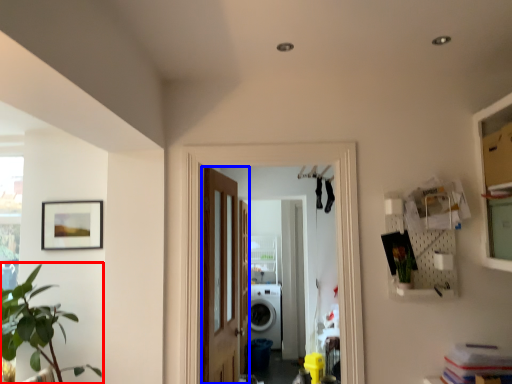
Question: Among these objects, which one is nearest to the camera, houseplant (highlighted by a red box) or door (highlighted by a blue box)?

Choices:
 (A) houseplant
 (B) door

Answer: (A)